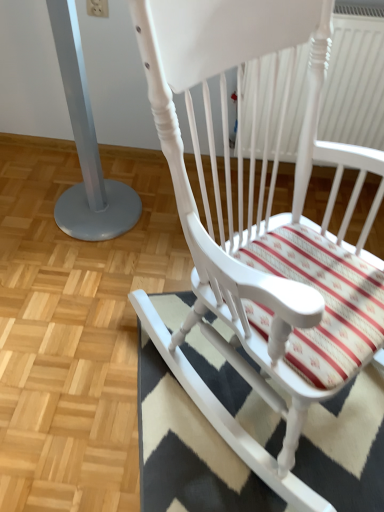
The image size is (384, 512). I want to click on unoccupied space behind silver metallic pole at left, so click(111, 167).